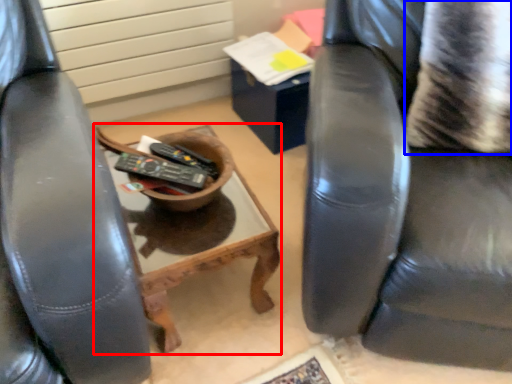
Question: Which object is further to the camera taking this photo, table (highlighted by a red box) or pillow (highlighted by a blue box)?

Choices:
 (A) table
 (B) pillow

Answer: (A)